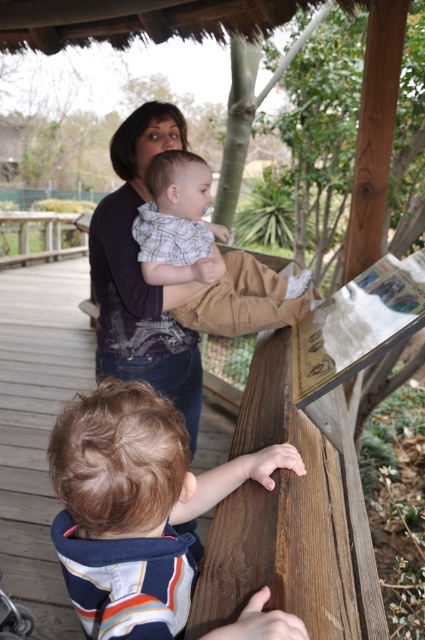
Who is taller, brown textured hair at upper center or metallic silver baby carriage at lower left?

brown textured hair at upper center

Does brown textured hair at upper center have a greater height compared to metallic silver baby carriage at lower left?

Yes.

Is point (107, 609) positioned in front of point (11, 618)?

Yes, point (107, 609) is closer to viewer.

Find the location of a particular element. brown textured hair at upper center is located at coordinates (135, 508).

Can you confirm if brown textured hair at upper center is positioned above light brown cotton pants at upper center?

Actually, brown textured hair at upper center is below light brown cotton pants at upper center.

Who is positioned more to the right, brown textured hair at upper center or light brown cotton pants at upper center?

light brown cotton pants at upper center is more to the right.

Identify the location of brown textured hair at upper center. (135, 508).

Is light brown cotton pants at upper center smaller than metallic silver baby carriage at lower left?

No.

Is point (240, 289) less distant than point (23, 630)?

No, (240, 289) is further to viewer.

Does point (260, 314) come farther from viewer compared to point (0, 632)?

No, it is in front of (0, 632).

What are the coordinates of `light brown cotton pants at upper center` in the screenshot? It's located at (207, 256).